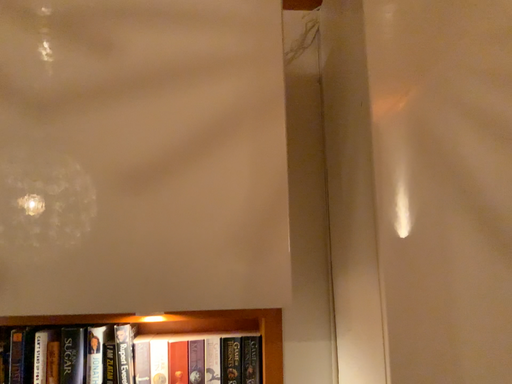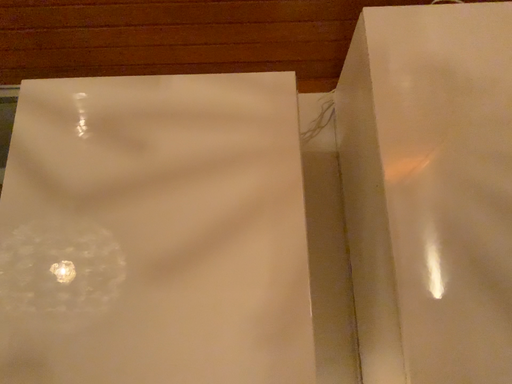
Question: How did the camera likely rotate when shooting the video?

Choices:
 (A) rotated downward
 (B) rotated upward

Answer: (B)